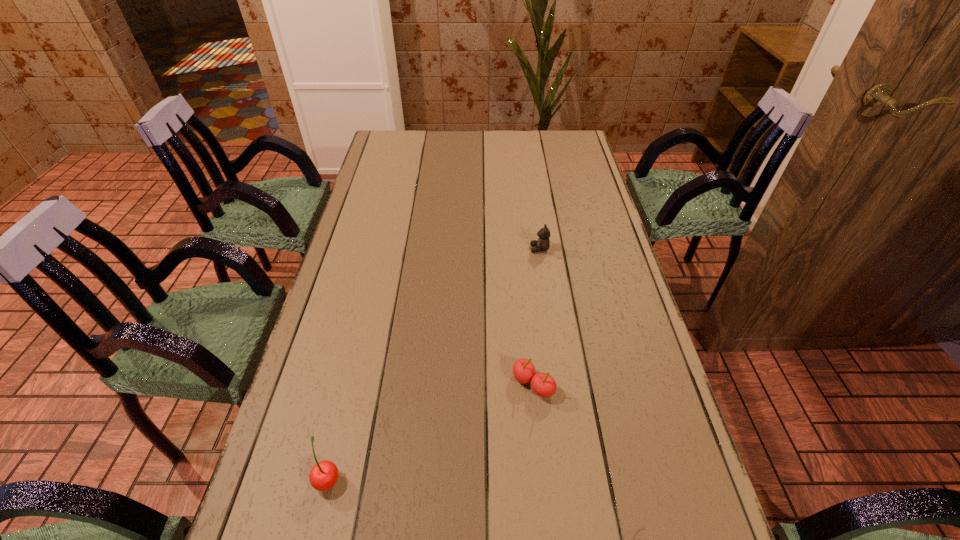
Find the location of a particular element. The image size is (960, 540). object that is positioned at the left edge is located at coordinates (323, 476).

What are the coordinates of `free region at the far edge of the desktop` in the screenshot? It's located at (469, 154).

The height and width of the screenshot is (540, 960). I want to click on free space at the left edge of the desktop, so click(275, 461).

At what (x,y) coordinates should I click in order to perform the action: click on vacant point at the right edge. Please return your answer as a coordinate pair (x, y). This screenshot has width=960, height=540. Looking at the image, I should click on point(594,200).

Where is `vacant area at the far left corner`? vacant area at the far left corner is located at coordinates (384, 150).

Where is `vacant space at the far right corner of the desktop`? This screenshot has width=960, height=540. vacant space at the far right corner of the desktop is located at coordinates (569, 160).

You are a GUI agent. You are given a task and a screenshot of the screen. Output one action in this format:
    pyautogui.click(x=<x>, y=<y>)
    Task: Click on the empty space that is in between the tallest object and the farther cherry
    Image resolution: width=960 pixels, height=540 pixels.
    Given the screenshot: What is the action you would take?
    (x=431, y=431)

I want to click on unoccupied area between the teddy bear and the nearer cherry, so click(x=434, y=363).

Find the location of a particular element. The height and width of the screenshot is (540, 960). free area in between the shorter cherry and the teddy bear is located at coordinates (537, 316).

The height and width of the screenshot is (540, 960). I want to click on vacant area that lies between the teddy bear and the taller cherry, so click(434, 363).